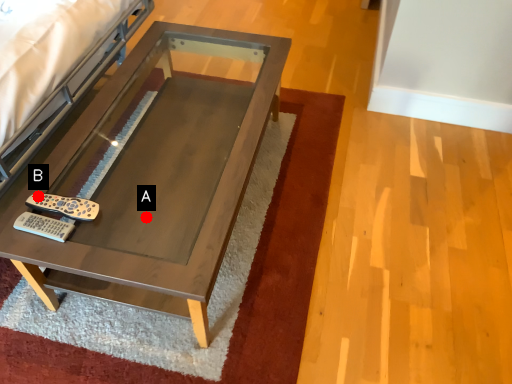
Question: Two points are circled on the image, labeled by A and B beside each circle. Among these points, which one is nearest to the camera?

Choices:
 (A) A is closer
 (B) B is closer

Answer: (B)